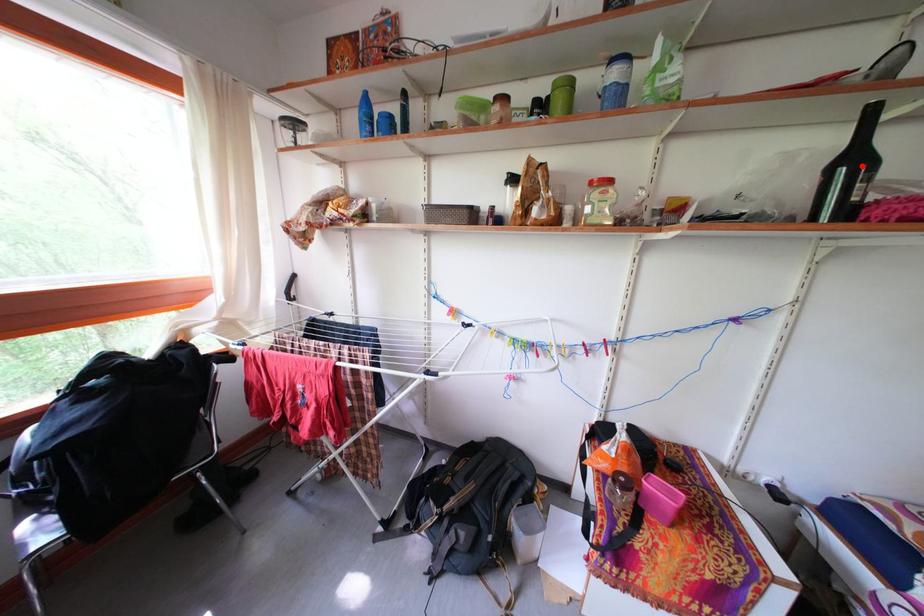
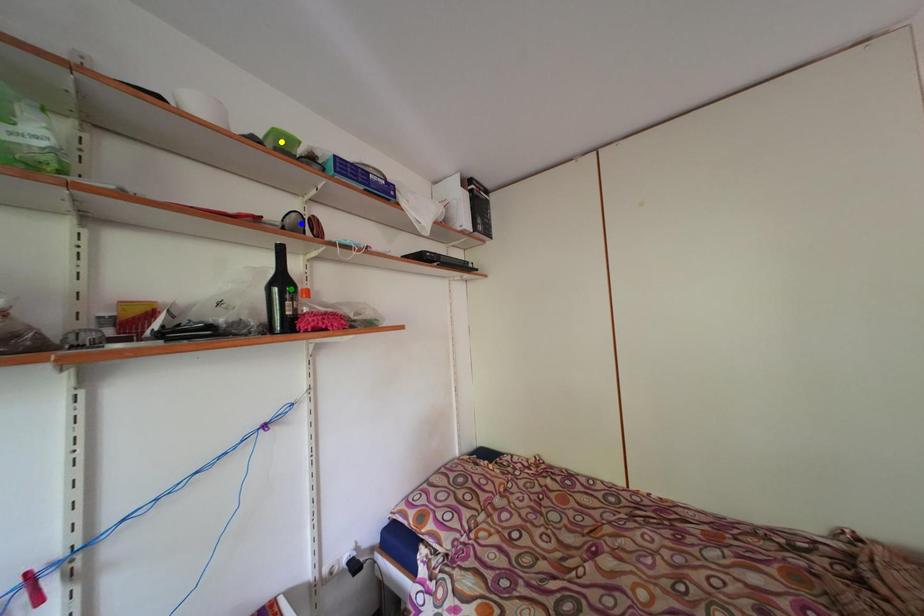
Question: I am providing you with two images of the same scene from different viewpoints. A red point is marked on the first image. You are given multiple points on the second image. Can you choose the point in image 2 that corresponds to the point in image 1?

Choices:
 (A) green point
 (B) blue point
 (C) yellow point

Answer: (A)